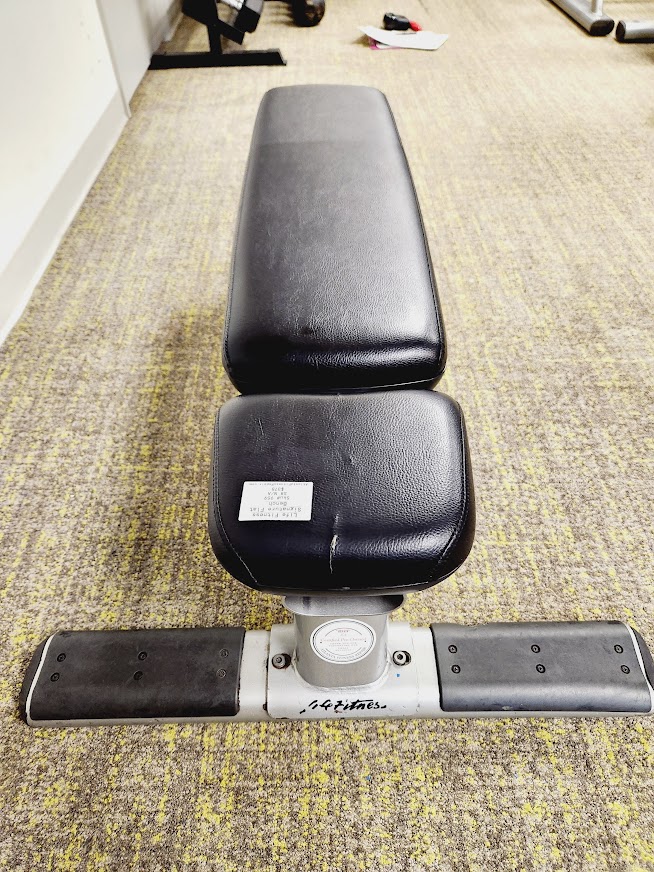
This screenshot has width=654, height=872. In order to click on grey skirting in this screenshot , I will do `click(19, 277)`.